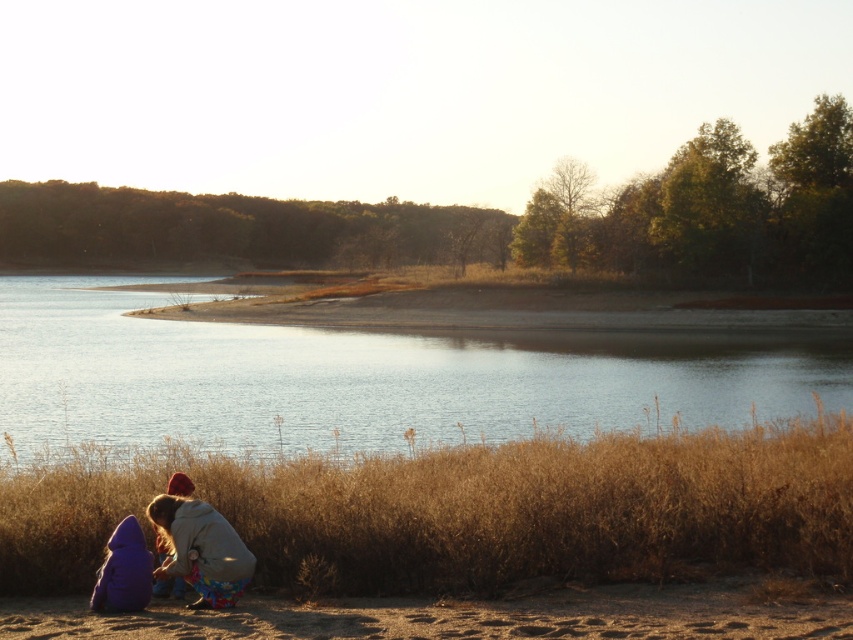
You are standing at the edge of the lake and want to sit down. Which object, the brown sandy ground at lower left or the purple fleece jacket at lower left, would you choose if you want to sit on the larger area?

The purple fleece jacket at lower left occupies a larger area than the brown sandy ground at lower left, so you should choose the purple fleece jacket at lower left to sit on the larger area.

You are standing at the edge of the lake and want to take a photo of the purple fleece jacket at lower left without the clear blue water at center blocking the view. Is this possible?

The purple fleece jacket at lower left is behind the clear blue water at center, so you cannot take a photo of the purple fleece jacket at lower left without the clear blue water at center blocking the view.